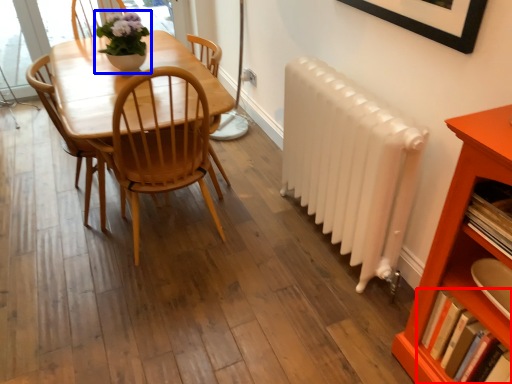
Question: Among these objects, which one is farthest to the camera, book (highlighted by a red box) or houseplant (highlighted by a blue box)?

Choices:
 (A) book
 (B) houseplant

Answer: (B)